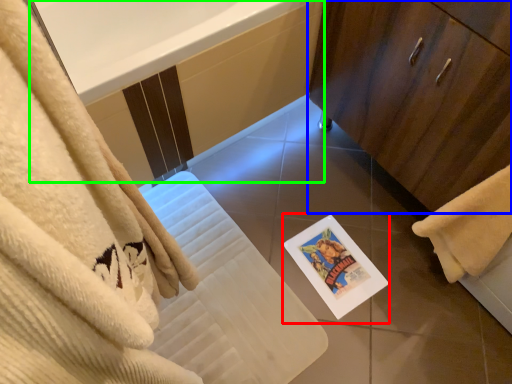
Question: Estimate the real-world distances between objects in this image. Which object is closer to postcard (highlighted by a red box), bathroom cabinet (highlighted by a blue box) or bath (highlighted by a green box)?

Choices:
 (A) bathroom cabinet
 (B) bath

Answer: (A)